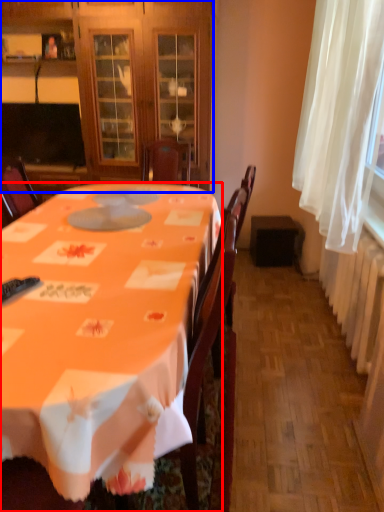
Question: Which object is further to the camera taking this photo, desk (highlighted by a red box) or cabinetry (highlighted by a blue box)?

Choices:
 (A) desk
 (B) cabinetry

Answer: (B)